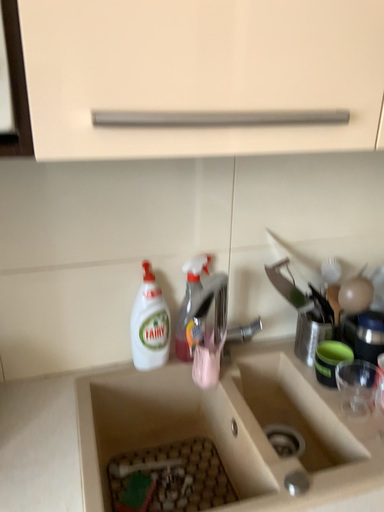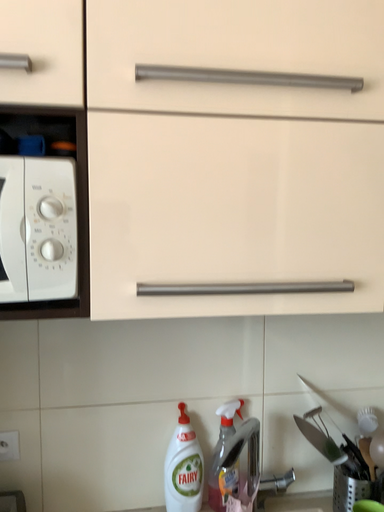
Question: How did the camera likely rotate when shooting the video?

Choices:
 (A) rotated left
 (B) rotated right

Answer: (A)